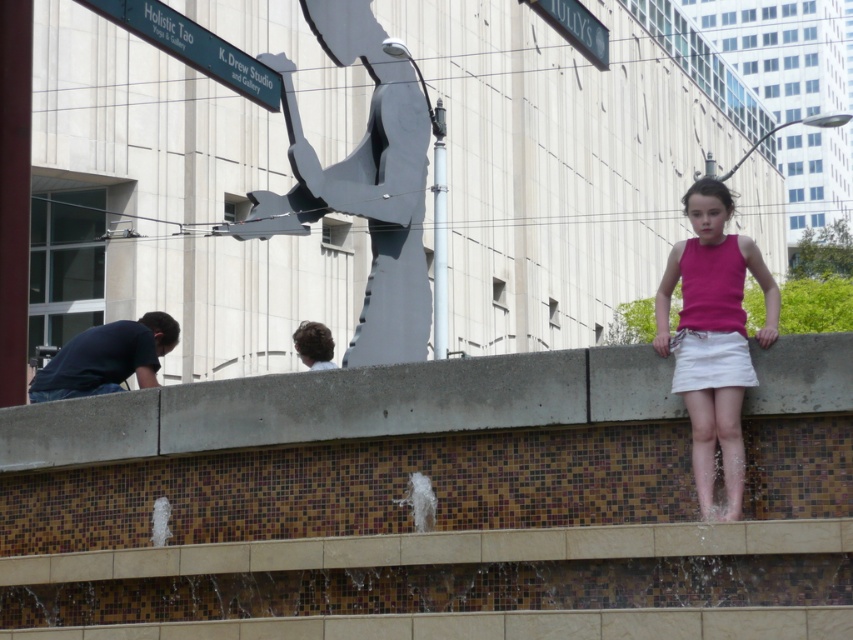
You are standing at point (688,387) and want to walk to point (219,227). Based on the scene, which direction should you move to reach your destination?

Since point (219,227) is behind point (688,387), you should move backward to reach your destination.

You are a photographer trying to capture both the gray metallic sculpture at center and the dark blue shirt at lower left in a single shot. Which object should you focus on first to ensure both are in frame?

The gray metallic sculpture at center is larger in size than the dark blue shirt at lower left, so you should focus on the gray metallic sculpture at center first to ensure both are in frame.

You are a photographer trying to capture both the gray metallic sculpture at center and the pink fabric skirt at right in the same frame. Considering their sizes, which object should you focus on first to ensure both are visible in the photo?

The gray metallic sculpture at center is much taller than the pink fabric skirt at right, so you should focus on the gray metallic sculpture at center first to ensure both are visible in the photo.